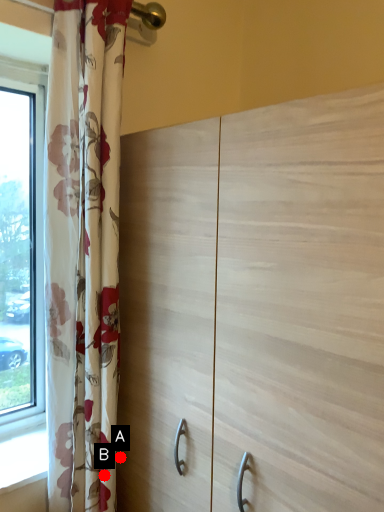
Question: Two points are circled on the image, labeled by A and B beside each circle. Which point appears closest to the camera in this image?

Choices:
 (A) A is closer
 (B) B is closer

Answer: (B)